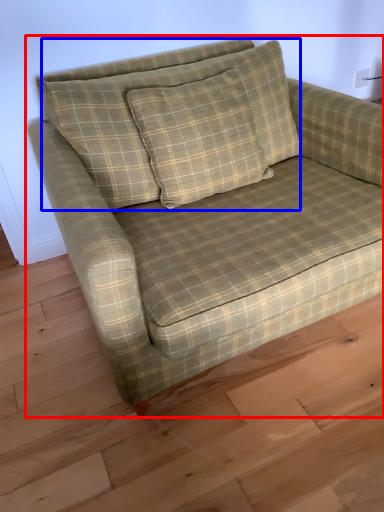
Question: Which point is further to the camera, studio couch (highlighted by a red box) or pillow (highlighted by a blue box)?

Choices:
 (A) studio couch
 (B) pillow

Answer: (B)